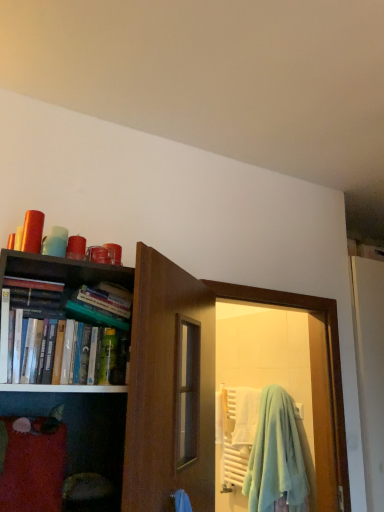
Question: In terms of width, does hardcover books at left look wider or thinner when compared to green plastic bottle at center?

Choices:
 (A) wide
 (B) thin

Answer: (A)

Question: Is hardcover books at left situated inside green plastic bottle at center or outside?

Choices:
 (A) inside
 (B) outside

Answer: (B)

Question: Estimate the real-world distances between objects in this image. Which object is closer to the hardcover books at left?

Choices:
 (A) light blue fleece beach towel at door
 (B) green plastic bottle at center

Answer: (B)

Question: Based on their relative distances, which object is farther from the hardcover books at left?

Choices:
 (A) light blue fleece beach towel at door
 (B) green plastic bottle at center

Answer: (A)